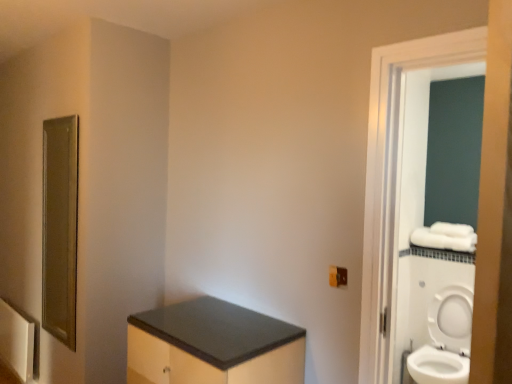
The image size is (512, 384). What do you see at coordinates (337, 276) in the screenshot?
I see `matte brown electric outlet at lower right` at bounding box center [337, 276].

Describe the element at coordinates (445, 237) in the screenshot. The width and height of the screenshot is (512, 384). I see `white fabric towel bar at right` at that location.

The image size is (512, 384). Find the location of `white glossy screen door at right`. white glossy screen door at right is located at coordinates (393, 178).

Is point (437, 320) behind point (339, 278)?

Yes, it is.

Which of these two, white glossy toilet at right or matte brown electric outlet at lower right, is wider?

Wider between the two is white glossy toilet at right.

From the image's perspective, which one is positioned higher, white glossy toilet at right or matte brown electric outlet at lower right?

matte brown electric outlet at lower right.

In terms of height, does white glossy toilet at right look taller or shorter compared to matte brown electric outlet at lower right?

In the image, white glossy toilet at right appears to be taller than matte brown electric outlet at lower right.

From a real-world perspective, is matte black cabinet at lower center positioned above or below white glossy screen door at right?

matte black cabinet at lower center is situated lower than white glossy screen door at right in the real world.

Considering the sizes of matte black cabinet at lower center and white glossy screen door at right in the image, is matte black cabinet at lower center wider or thinner than white glossy screen door at right?

Considering their sizes, matte black cabinet at lower center looks broader than white glossy screen door at right.

Considering the relative positions of matte black cabinet at lower center and white glossy screen door at right in the image provided, is matte black cabinet at lower center in front of white glossy screen door at right?

No, it is behind white glossy screen door at right.

Can you confirm if matte black cabinet at lower center is shorter than white glossy screen door at right?

Yes.

Is white fabric towel bar at right thinner than white glossy toilet at right?

Indeed, white fabric towel bar at right has a lesser width compared to white glossy toilet at right.

From the image's perspective, does white fabric towel bar at right appear higher than white glossy toilet at right?

Yes, from the image's perspective, white fabric towel bar at right is above white glossy toilet at right.

Is white fabric towel bar at right in contact with white glossy toilet at right?

There is a gap between white fabric towel bar at right and white glossy toilet at right.

Who is more distant, matte black cabinet at lower center or gold textured mirror at left?

gold textured mirror at left is further from the camera.

From the picture: From a real-world perspective, relative to gold textured mirror at left, is matte black cabinet at lower center vertically above or below?

In terms of real-world spatial position, matte black cabinet at lower center is below gold textured mirror at left.

Is matte black cabinet at lower center far from gold textured mirror at left?

No, matte black cabinet at lower center is in close proximity to gold textured mirror at left.

From a real-world perspective, is white fabric towel bar at right positioned over gold textured mirror at left based on gravity?

Actually, white fabric towel bar at right is physically below gold textured mirror at left in the real world.

Does white fabric towel bar at right appear on the right side of gold textured mirror at left?

Yes, white fabric towel bar at right is to the right of gold textured mirror at left.

Looking at this image, who is more distant, white fabric towel bar at right or gold textured mirror at left?

white fabric towel bar at right is further away from the camera.

Is white fabric towel bar at right positioned far away from gold textured mirror at left?

Yes, white fabric towel bar at right and gold textured mirror at left are located far from each other.

Considering the positions of points (461, 241) and (344, 271), is point (461, 241) closer to camera compared to point (344, 271)?

No, (461, 241) is behind (344, 271).

Find the location of a particular element. towel bar that is on the right side of matte brown electric outlet at lower right is located at coordinates (445, 237).

Is white fabric towel bar at right positioned far away from matte brown electric outlet at lower right?

Absolutely, white fabric towel bar at right is distant from matte brown electric outlet at lower right.

Considering the relative sizes of white fabric towel bar at right and matte brown electric outlet at lower right in the image provided, is white fabric towel bar at right wider than matte brown electric outlet at lower right?

Indeed, white fabric towel bar at right has a greater width compared to matte brown electric outlet at lower right.

Is matte black cabinet at lower center facing away from white fabric towel bar at right?

That's right, matte black cabinet at lower center is facing away from white fabric towel bar at right.

Is matte black cabinet at lower center next to white fabric towel bar at right and touching it?

No, matte black cabinet at lower center is not next to white fabric towel bar at right.

How different are the orientations of matte black cabinet at lower center and white fabric towel bar at right in degrees?

They differ by 0.0785 degrees in their facing directions.

At what (x,y) coordinates should I click in order to perform the action: click on electric outlet located on the left of white glossy toilet at right. Please return your answer as a coordinate pair (x, y). Looking at the image, I should click on (337, 276).

This screenshot has width=512, height=384. I want to click on bathroom cabinet that is under the white glossy screen door at right (from a real-world perspective), so click(213, 346).

From the image, which object appears to be farther from matte black cabinet at lower center, white glossy toilet at right or white glossy screen door at right?

white glossy toilet at right.

When comparing their distances from white glossy toilet at right, does white fabric towel bar at right or matte brown electric outlet at lower right seem closer?

Among the two, white fabric towel bar at right is located nearer to white glossy toilet at right.

Based on their spatial positions, is matte brown electric outlet at lower right or white glossy toilet at right further from white fabric towel bar at right?

The object further to white fabric towel bar at right is matte brown electric outlet at lower right.

Looking at the image, which one is located closer to matte brown electric outlet at lower right, white glossy toilet at right or gold textured mirror at left?

Based on the image, white glossy toilet at right appears to be nearer to matte brown electric outlet at lower right.

From the image, which object appears to be farther from white fabric towel bar at right, white glossy screen door at right or matte black cabinet at lower center?

matte black cabinet at lower center.

From the image, which object appears to be farther from white glossy toilet at right, gold textured mirror at left or white fabric towel bar at right?

gold textured mirror at left is positioned further to the anchor white glossy toilet at right.

When comparing their distances from white glossy toilet at right, does matte black cabinet at lower center or gold textured mirror at left seem further?

The object further to white glossy toilet at right is gold textured mirror at left.

Looking at the image, which one is located closer to white fabric towel bar at right, white glossy screen door at right or matte brown electric outlet at lower right?

white glossy screen door at right is closer to white fabric towel bar at right.

Find the location of a particular element. screen door between gold textured mirror at left and white glossy toilet at right in the horizontal direction is located at coordinates (393, 178).

You are a GUI agent. You are given a task and a screenshot of the screen. Output one action in this format:
    pyautogui.click(x=<x>, y=<y>)
    Task: Click on the bathroom cabinet between gold textured mirror at left and white fabric towel bar at right from left to right
    This screenshot has width=512, height=384.
    Given the screenshot: What is the action you would take?
    pyautogui.click(x=213, y=346)

This screenshot has width=512, height=384. Identify the location of bathroom cabinet located between gold textured mirror at left and white glossy toilet at right in the left-right direction. (213, 346).

The width and height of the screenshot is (512, 384). Identify the location of electric outlet situated between matte black cabinet at lower center and white glossy screen door at right from left to right. (337, 276).